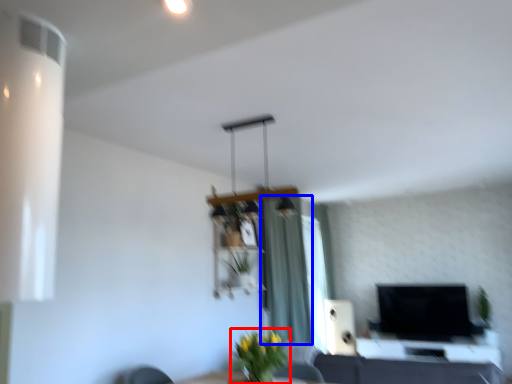
Question: Which point is further to the camera, plant (highlighted by a red box) or curtain (highlighted by a blue box)?

Choices:
 (A) plant
 (B) curtain

Answer: (B)